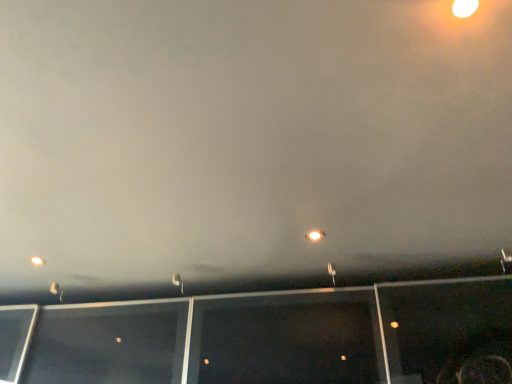
Question: From the image's perspective, is metallic street light at lower left, which ranks as the fourth street light in right-to-left order, located above or below white plastic street light at center, which is the second street light in left-to-right order?

Choices:
 (A) above
 (B) below

Answer: (B)

Question: From their relative heights in the image, would you say metallic street light at lower left, which is the 4th street light in top-to-bottom order, is taller or shorter than white plastic street light at center, the second street light positioned from the bottom?

Choices:
 (A) short
 (B) tall

Answer: (A)

Question: Estimate the real-world distances between objects in this image. Which object is closer to the matte white light at center, the 3th street light when ordered from left to right?

Choices:
 (A) metallic silver street light at center, the 3th street light when ordered from back to front
 (B) white plastic street light at center, which is the second street light in left-to-right order
 (C) metallic street light at lower left, which is the 4th street light in top-to-bottom order

Answer: (A)

Question: Estimate the real-world distances between objects in this image. Which object is closer to the metallic street light at lower left, which ranks as the fourth street light in right-to-left order?

Choices:
 (A) metallic silver street light at center, the second street light when ordered from front to back
 (B) matte white light at center, the 2th street light in the right-to-left sequence
 (C) white plastic street light at center, which is the 3th street light in front-to-back order

Answer: (C)